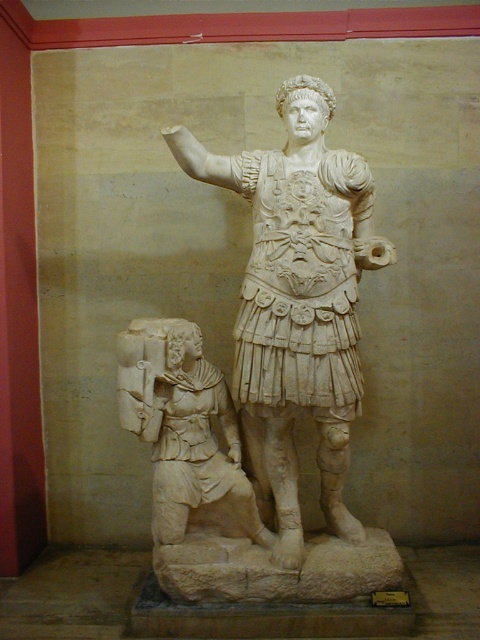
You are standing in the museum and want to take a photo of the white marble statue at center. The museum has a rule that visitors must stand exactly at the point marked as point (x=298, y=301) to take photos. Are you currently positioned correctly to take the photo?

The white marble statue at center is located at point (x=298, y=301), so yes, if you are standing at that point, you are correctly positioned to take the photo.

You are a tour guide explaining the layout of the museum exhibit. You mention the white marble statue at center and the white marble figure at lower left. Which one is positioned to the right of the other?

The white marble statue at center is positioned to the right of the white marble figure at lower left.

You are a museum visitor standing in front of the white marble statue at center and the white marble figure at lower left. Which object is closer to you?

The white marble statue at center is closer to you since it is in front of the white marble figure at lower left.